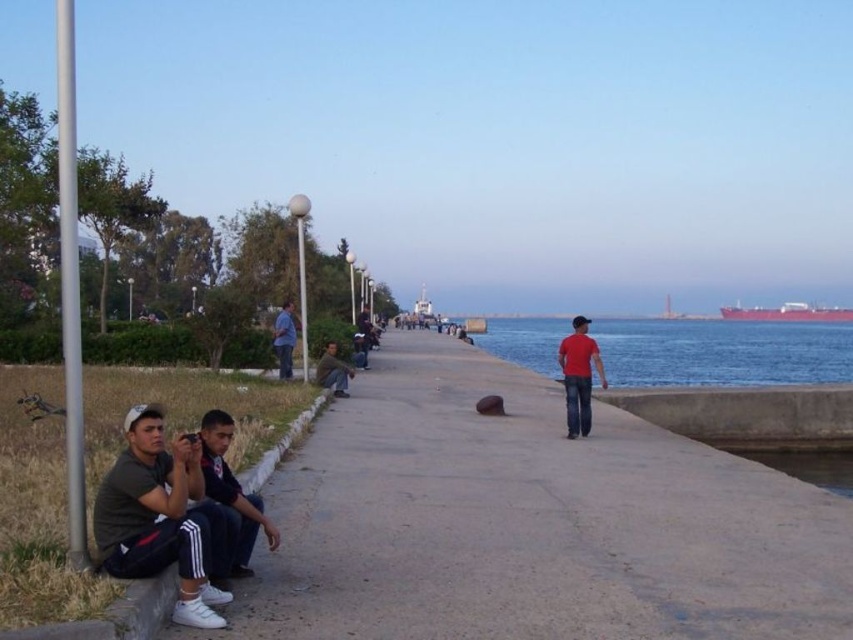
Question: Can you confirm if concrete at left is positioned to the left of dark blue jeans at lower left?

Choices:
 (A) no
 (B) yes

Answer: (A)

Question: Can you confirm if blue jeans at center is bigger than dark blue jeans at center?

Choices:
 (A) yes
 (B) no

Answer: (A)

Question: Which point is farther to the camera?

Choices:
 (A) dark blue jeans at center
 (B) blue water at right

Answer: (B)

Question: Is the position of dark blue jeans at lower left more distant than that of blue jeans at center?

Choices:
 (A) yes
 (B) no

Answer: (B)

Question: Estimate the real-world distances between objects in this image. Which object is farther from the blue water at right?

Choices:
 (A) concrete at left
 (B) dark green jersey at lower left

Answer: (B)

Question: Estimate the real-world distances between objects in this image. Which object is closer to the dark blue jeans at center?

Choices:
 (A) matte red shirt at center
 (B) dark green fabric jacket at center
 (C) dark blue jeans at lower left
 (D) red matte cargo ship at far right

Answer: (A)